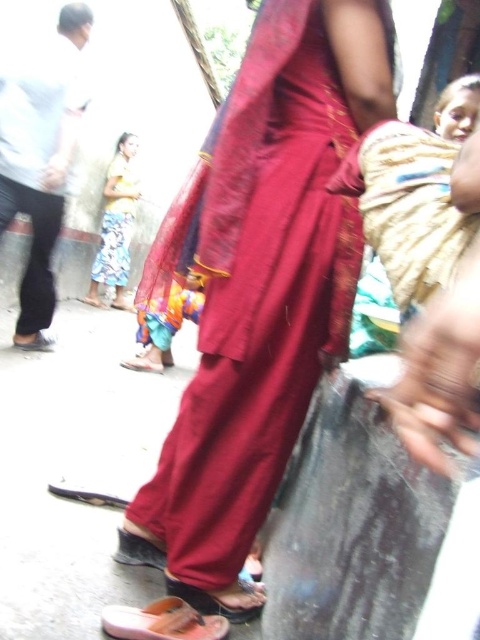
You are an artist who wants to paint the scene. You need to locate the exact position of the matte red fabric at center to ensure accurate placement in your artwork. What are the coordinates where you should place it?

The matte red fabric at center is located at coordinates point (261, 280).

You are a photographer trying to capture a closeup of the orange rubber sandal at lower center and the brown leather sandal at lower center without moving the subjects. Can you fit both sandals in your camera frame if your lens has a minimum focus distance of 3 inches?

The orange rubber sandal at lower center and brown leather sandal at lower center are 2.63 inches apart, so yes, the photographer can fit both sandals in the frame since the distance between them is less than the 3 inches minimum focus distance.

From the picture: You are a photographer setting up a shoot in this scene. You need to place a small prop between the orange rubber sandal at lower center and the brown leather sandal at lower center. Which sandal should the prop be placed closer to, based on their positions?

The orange rubber sandal at lower center is located above the brown leather sandal at lower center. Therefore, the prop should be placed closer to the brown leather sandal at lower center to be between them.